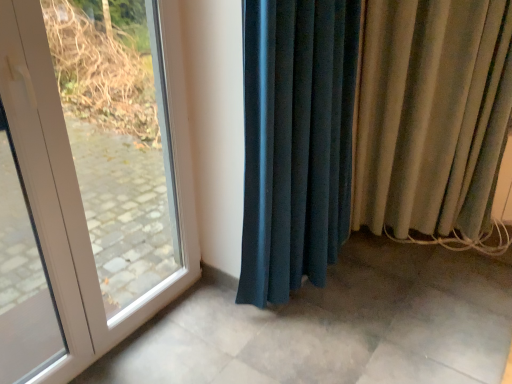
Question: Does velvet teal curtain at center, positioned as the 1th curtain in left-to-right order, have a greater width compared to white glossy door at left?

Choices:
 (A) yes
 (B) no

Answer: (A)

Question: Is there a large distance between velvet teal curtain at center, the 2th curtain viewed from the right, and white glossy door at left?

Choices:
 (A) no
 (B) yes

Answer: (A)

Question: Is velvet teal curtain at center, positioned as the 1th curtain in left-to-right order, at the left side of white glossy door at left?

Choices:
 (A) no
 (B) yes

Answer: (A)

Question: From a real-world perspective, is velvet teal curtain at center, the 2th curtain viewed from the right, beneath white glossy door at left?

Choices:
 (A) no
 (B) yes

Answer: (B)

Question: From the image's perspective, does velvet teal curtain at center, the 2th curtain viewed from the right, appear lower than white glossy door at left?

Choices:
 (A) no
 (B) yes

Answer: (A)

Question: Does velvet teal curtain at center, positioned as the 1th curtain in left-to-right order, turn towards white glossy door at left?

Choices:
 (A) no
 (B) yes

Answer: (A)

Question: Can you confirm if beige velvet curtain at right, which is the first curtain from right to left, is smaller than white glossy door at left?

Choices:
 (A) yes
 (B) no

Answer: (B)

Question: Is beige velvet curtain at right, the second curtain from the left, thinner than white glossy door at left?

Choices:
 (A) yes
 (B) no

Answer: (B)

Question: From the image's perspective, is beige velvet curtain at right, which is the first curtain from right to left, beneath white glossy door at left?

Choices:
 (A) no
 (B) yes

Answer: (A)

Question: Does beige velvet curtain at right, which is the first curtain from right to left, come behind white glossy door at left?

Choices:
 (A) no
 (B) yes

Answer: (B)

Question: Can we say beige velvet curtain at right, the second curtain from the left, lies outside white glossy door at left?

Choices:
 (A) no
 (B) yes

Answer: (B)

Question: Considering the relative sizes of beige velvet curtain at right, the second curtain from the left, and white glossy door at left in the image provided, is beige velvet curtain at right, the second curtain from the left, taller than white glossy door at left?

Choices:
 (A) yes
 (B) no

Answer: (B)

Question: Considering the relative sizes of white glossy door at left and beige velvet curtain at right, which is the first curtain from right to left, in the image provided, is white glossy door at left bigger than beige velvet curtain at right, which is the first curtain from right to left,?

Choices:
 (A) yes
 (B) no

Answer: (B)